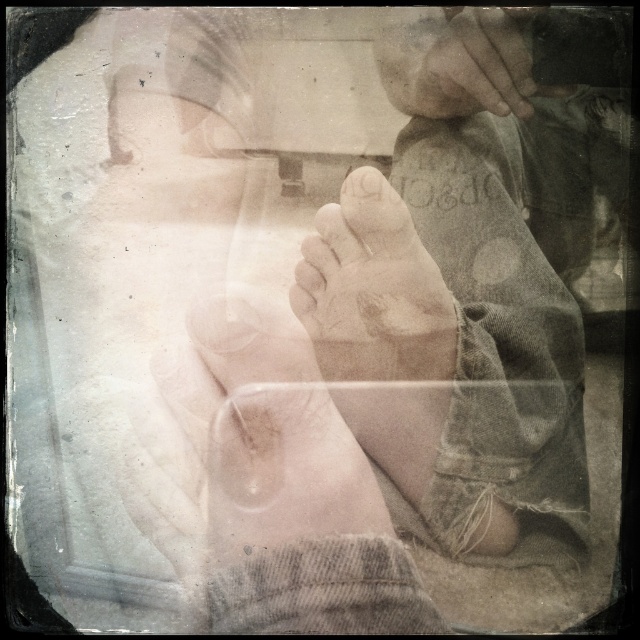
Between smooth skin hand at upper center and smooth skin toe at center, which one has more height?

smooth skin hand at upper center is taller.

Is smooth skin hand at upper center shorter than smooth skin toe at center?

In fact, smooth skin hand at upper center may be taller than smooth skin toe at center.

What do you see at coordinates (458, 64) in the screenshot? I see `smooth skin hand at upper center` at bounding box center [458, 64].

The width and height of the screenshot is (640, 640). I want to click on smooth skin hand at upper center, so click(458, 64).

Who is taller, smooth skin hand at center or smooth skin hand at upper center?

With more height is smooth skin hand at center.

Which is behind, point (342, 426) or point (484, 106)?

Positioned behind is point (342, 426).

At what (x,y) coordinates should I click in order to perform the action: click on smooth skin hand at center. Please return your answer as a coordinate pair (x, y). The width and height of the screenshot is (640, 640). Looking at the image, I should click on (275, 436).

Locate an element on the screen. The width and height of the screenshot is (640, 640). smooth skin foot at center is located at coordinates point(369,272).

Who is lower down, smooth skin foot at center or smooth skin toe at center?

smooth skin foot at center

The image size is (640, 640). Describe the element at coordinates (369, 272) in the screenshot. I see `smooth skin foot at center` at that location.

Find the location of a particular element. smooth skin foot at center is located at coordinates (369, 272).